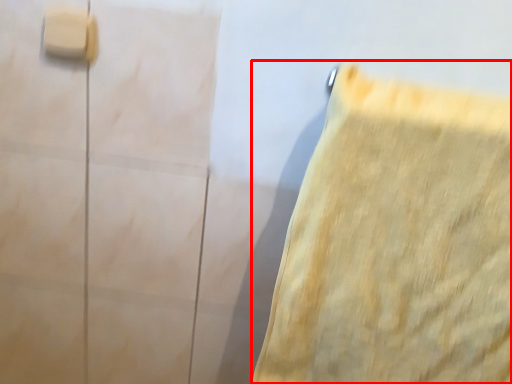
Question: From the image's perspective, what is the correct spatial positioning of towel (annotated by the red box) in reference to light switch?

Choices:
 (A) above
 (B) below

Answer: (B)